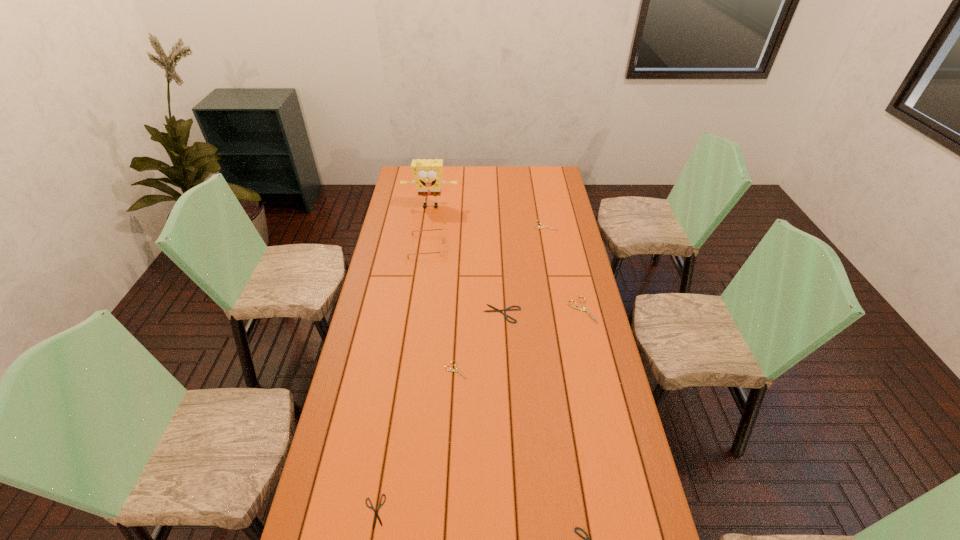
This screenshot has width=960, height=540. Find the location of `free point between the yellow sponge and the third tallest object`. free point between the yellow sponge and the third tallest object is located at coordinates (506, 259).

This screenshot has width=960, height=540. In order to click on unoccupied area between the fifth shortest object and the fourth farthest shears in this screenshot , I will do `click(500, 298)`.

Where is `vacant area that lies between the leftmost beige shears and the smallest black shears`? vacant area that lies between the leftmost beige shears and the smallest black shears is located at coordinates (415, 441).

At what (x,y) coordinates should I click in order to perform the action: click on unoccupied position between the farthest beige shears and the beige spectacles. Please return your answer as a coordinate pair (x, y). This screenshot has height=540, width=960. Looking at the image, I should click on (486, 236).

Where is `empty space between the yellow sponge and the tallest shears`? empty space between the yellow sponge and the tallest shears is located at coordinates (506, 259).

The height and width of the screenshot is (540, 960). Identify the location of object that is the fifth nearest to the fifth object from left to right. (427, 174).

Where is `object that can be found as the second closest to the spectacles`? The height and width of the screenshot is (540, 960). object that can be found as the second closest to the spectacles is located at coordinates (507, 309).

Choose which shears is the nearest neighbor to the second smallest black shears. Please provide its 2D coordinates. Your answer should be formatted as a tuple, i.e. [(x, y)], where the tuple contains the x and y coordinates of a point satisfying the conditions above.

[(376, 516)]

Identify which shears is located as the second nearest to the fourth tallest object. Please provide its 2D coordinates. Your answer should be formatted as a tuple, i.e. [(x, y)], where the tuple contains the x and y coordinates of a point satisfying the conditions above.

[(507, 309)]

Identify the location of beige shears that is the second closest to the sponge. (584, 308).